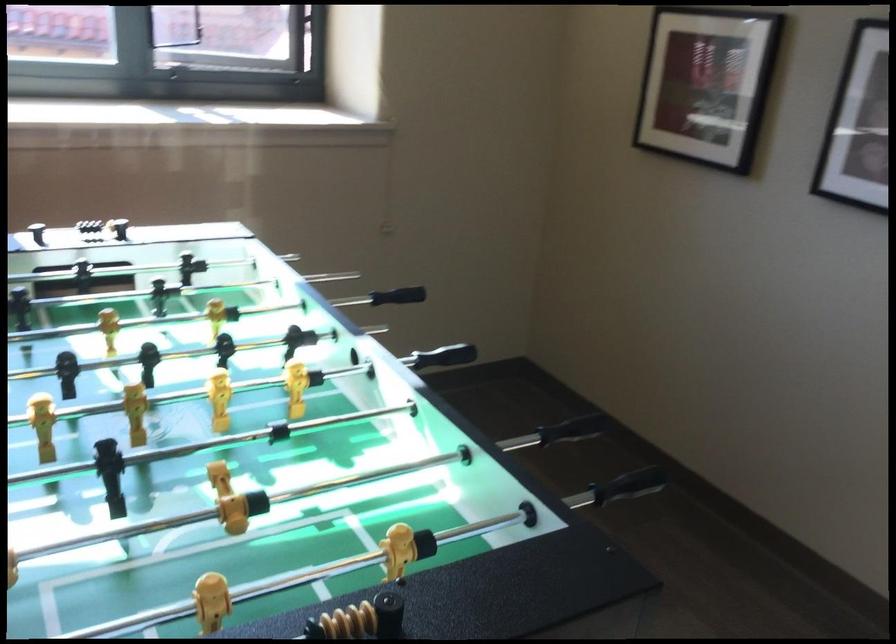
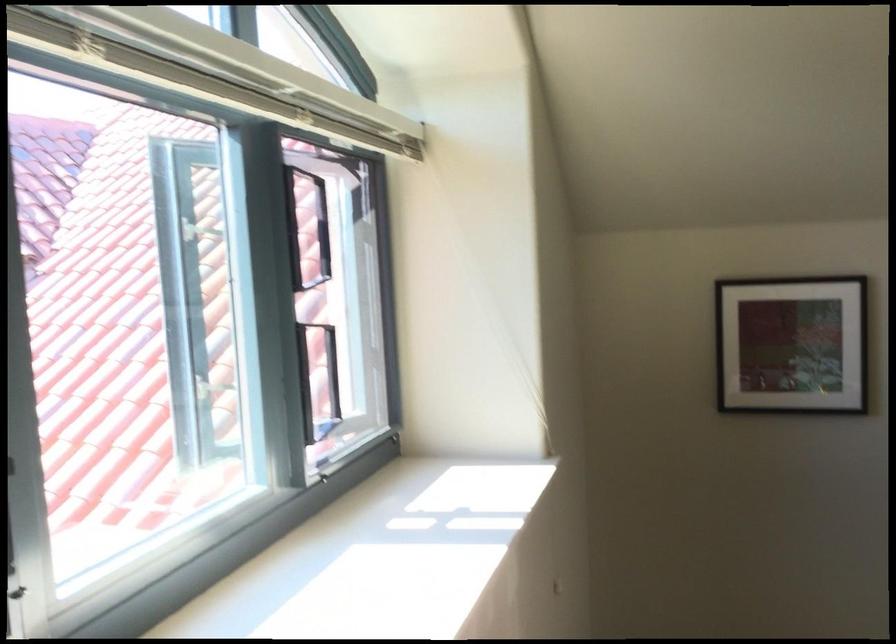
Find the pixel in the second image that matches pixel 686 80 in the first image.

(791, 345)